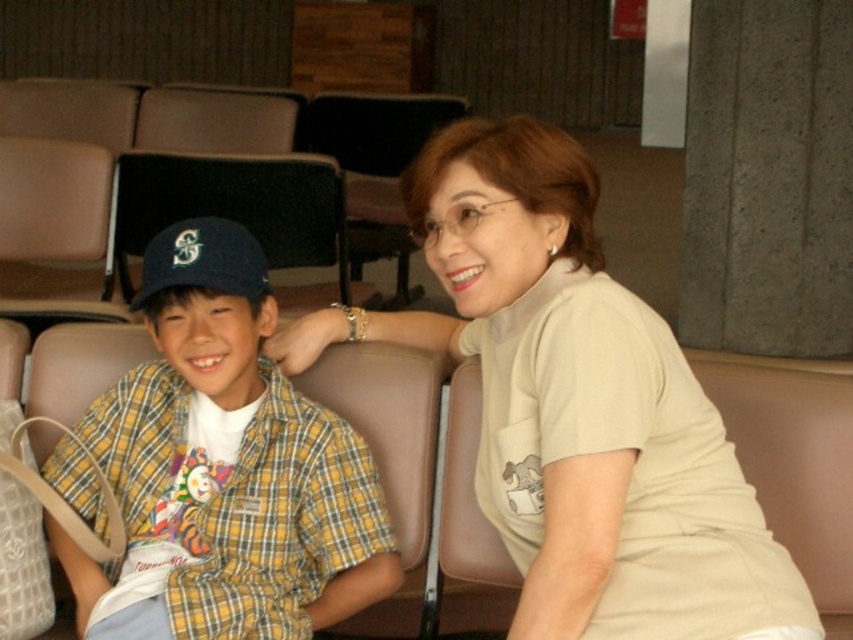
Measure the distance from beige cotton t-shirt at center to matte blue baseball cap at left.

beige cotton t-shirt at center and matte blue baseball cap at left are 57.82 centimeters apart from each other.

What do you see at coordinates (576, 406) in the screenshot?
I see `beige cotton t-shirt at center` at bounding box center [576, 406].

Who is more distant from viewer, (431, 243) or (213, 236)?

Positioned behind is point (213, 236).

This screenshot has height=640, width=853. Identify the location of beige cotton t-shirt at center. (576, 406).

Which is more to the left, concrete wall at upper right or matte blue baseball cap at left?

matte blue baseball cap at left

Measure the distance from concrete wall at upper right to matte blue baseball cap at left.

A distance of 9.66 feet exists between concrete wall at upper right and matte blue baseball cap at left.

I want to click on concrete wall at upper right, so click(769, 177).

Identify the location of concrete wall at upper right. This screenshot has width=853, height=640. (769, 177).

What do you see at coordinates (576, 406) in the screenshot?
I see `beige cotton t-shirt at center` at bounding box center [576, 406].

Is point (302, 358) positioned behind point (360, 180)?

No, it is not.

Is point (473, 193) less distant than point (363, 246)?

Yes, point (473, 193) is in front of point (363, 246).

This screenshot has width=853, height=640. I want to click on beige cotton t-shirt at center, so click(x=576, y=406).